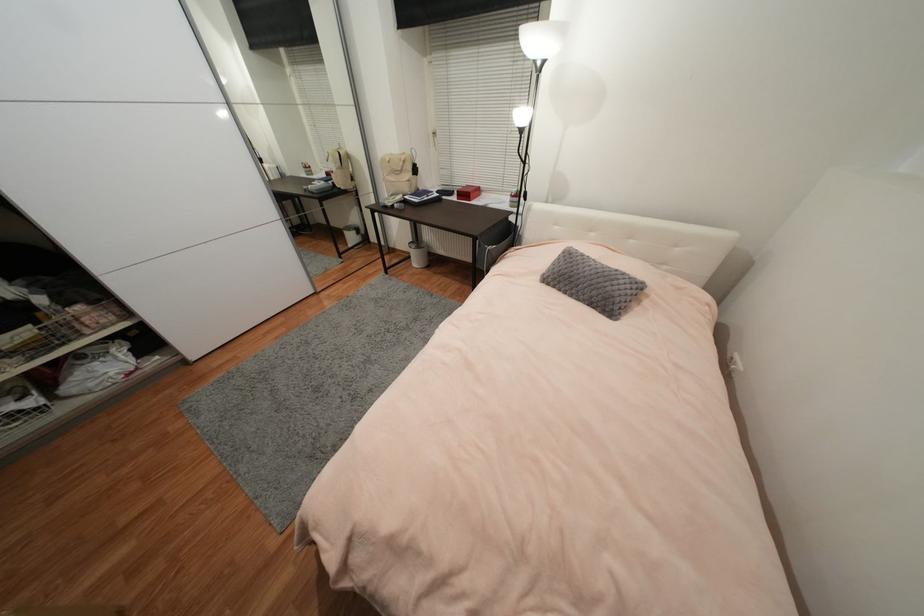
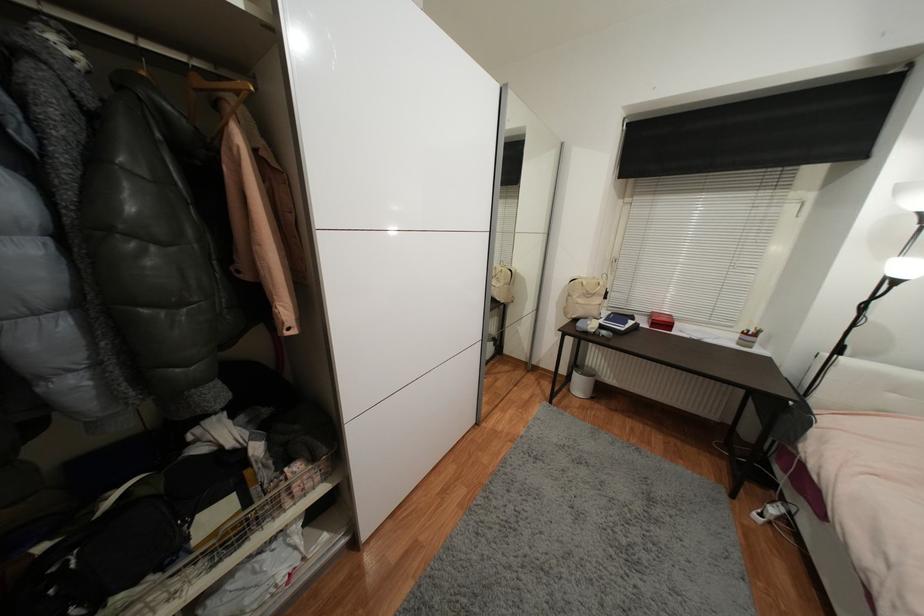
Question: The images are taken continuously from a first-person perspective. In which direction are you moving?

Choices:
 (A) Left
 (B) Right
 (C) Forward
 (D) Backward

Answer: (A)